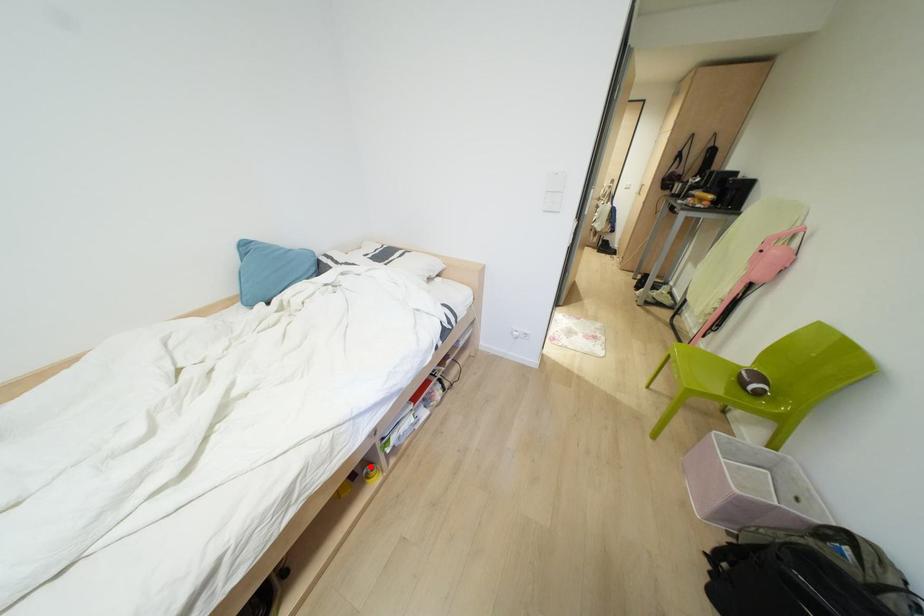
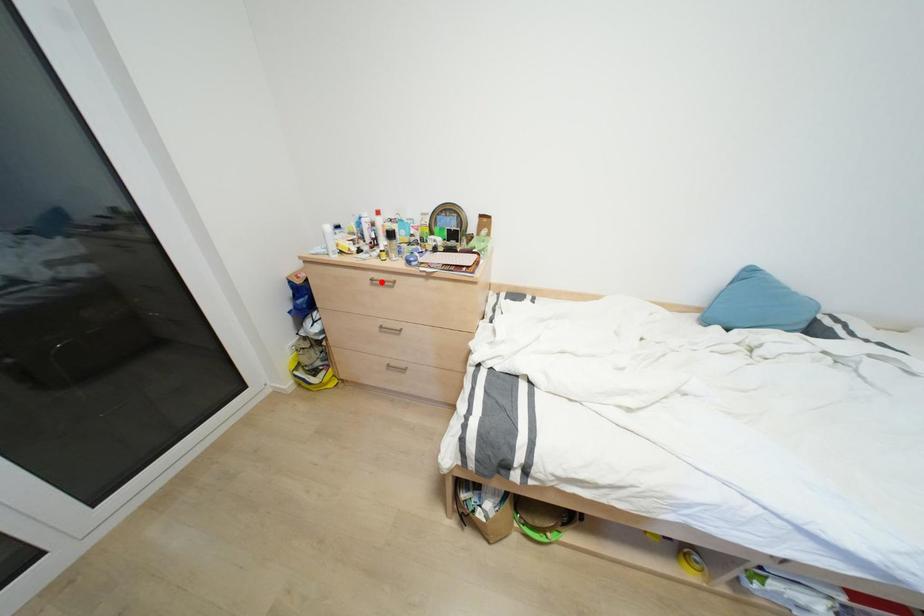
I am providing you with two images of the same scene from different viewpoints. A red point is marked on the first image and another point is marked on the second image. Are the points marked in image1 and image2 representing the same 3D position?

No